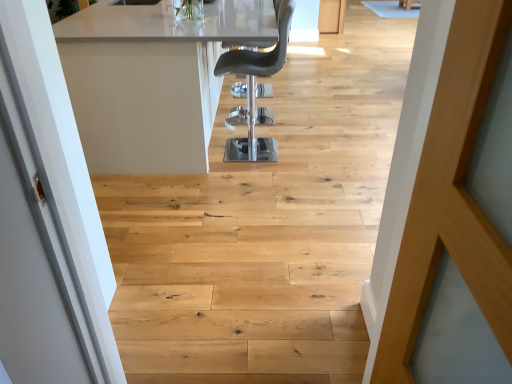
Question: Is white glossy table at center at the right side of black leather chair at center?

Choices:
 (A) yes
 (B) no

Answer: (B)

Question: Considering the relative positions of white glossy table at center and black leather chair at center in the image provided, is white glossy table at center to the left of black leather chair at center from the viewer's perspective?

Choices:
 (A) no
 (B) yes

Answer: (B)

Question: Is the depth of white glossy table at center less than that of black leather chair at center?

Choices:
 (A) no
 (B) yes

Answer: (B)

Question: Considering the relative sizes of white glossy table at center and black leather chair at center in the image provided, is white glossy table at center wider than black leather chair at center?

Choices:
 (A) no
 (B) yes

Answer: (B)

Question: Is white glossy table at center thinner than black leather chair at center?

Choices:
 (A) no
 (B) yes

Answer: (A)

Question: Is white glossy table at center positioned with its back to black leather chair at center?

Choices:
 (A) yes
 (B) no

Answer: (B)

Question: From a real-world perspective, is black leather chair at center on top of white glossy table at center?

Choices:
 (A) yes
 (B) no

Answer: (A)

Question: Is black leather chair at center oriented towards white glossy table at center?

Choices:
 (A) no
 (B) yes

Answer: (B)

Question: Is black leather chair at center taller than white glossy table at center?

Choices:
 (A) yes
 (B) no

Answer: (A)

Question: Considering the relative positions of black leather chair at center and white glossy table at center in the image provided, is black leather chair at center to the right of white glossy table at center from the viewer's perspective?

Choices:
 (A) yes
 (B) no

Answer: (A)

Question: Does black leather chair at center have a greater width compared to white glossy table at center?

Choices:
 (A) yes
 (B) no

Answer: (B)

Question: Can you confirm if black leather chair at center is smaller than white glossy table at center?

Choices:
 (A) yes
 (B) no

Answer: (A)

Question: From a real-world perspective, is white glossy table at center physically located above or below black leather chair at center?

Choices:
 (A) below
 (B) above

Answer: (A)